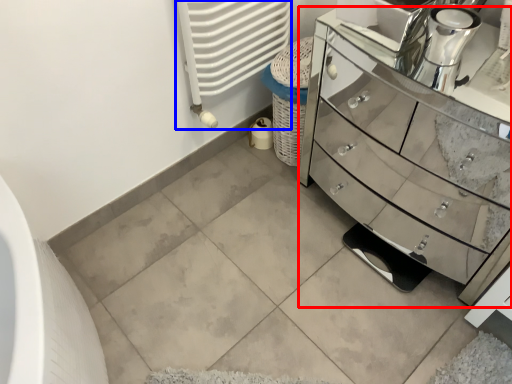
Question: Which object appears closest to the camera in this image, chest of drawers (highlighted by a red box) or radiator (highlighted by a blue box)?

Choices:
 (A) chest of drawers
 (B) radiator

Answer: (A)